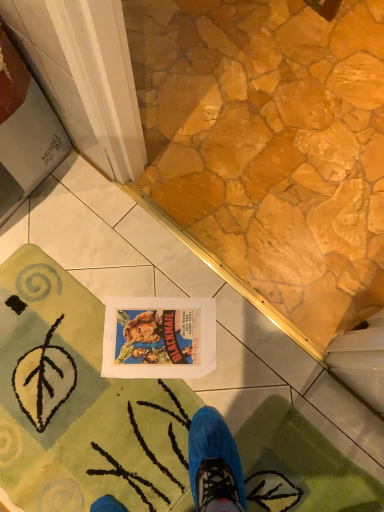
This screenshot has width=384, height=512. Identify the location of blank space situated above green plush bath mat at lower left, the 2th bath mat positioned from the right (from a real-world perspective). (77, 407).